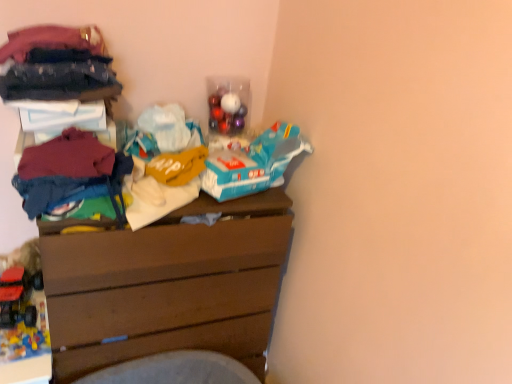
Question: Is the depth of rubberized plastic toy truck at lower left, acting as the first toy starting from the top, less than that of brown wooden chest of drawers at center?

Choices:
 (A) no
 (B) yes

Answer: (A)

Question: Can we say rubberized plastic toy truck at lower left, acting as the first toy starting from the top, lies outside brown wooden chest of drawers at center?

Choices:
 (A) no
 (B) yes

Answer: (B)

Question: Is rubberized plastic toy truck at lower left, acting as the first toy starting from the top, oriented towards brown wooden chest of drawers at center?

Choices:
 (A) no
 (B) yes

Answer: (A)

Question: From the image's perspective, is rubberized plastic toy truck at lower left, acting as the first toy starting from the top, beneath brown wooden chest of drawers at center?

Choices:
 (A) no
 (B) yes

Answer: (A)

Question: Does rubberized plastic toy truck at lower left, placed as the 2th toy when sorted from bottom to top, lie behind brown wooden chest of drawers at center?

Choices:
 (A) no
 (B) yes

Answer: (B)

Question: Considering the positions of rubberized plastic toy truck at lower left, which ranks as the second toy in top-to-bottom order, and brown wooden chest of drawers at center in the image, is rubberized plastic toy truck at lower left, which ranks as the second toy in top-to-bottom order, taller or shorter than brown wooden chest of drawers at center?

Choices:
 (A) short
 (B) tall

Answer: (A)

Question: From the image's perspective, is rubberized plastic toy truck at lower left, positioned as the 1th toy in bottom-to-top order, positioned above or below brown wooden chest of drawers at center?

Choices:
 (A) above
 (B) below

Answer: (B)

Question: In terms of width, does rubberized plastic toy truck at lower left, which ranks as the second toy in top-to-bottom order, look wider or thinner when compared to brown wooden chest of drawers at center?

Choices:
 (A) wide
 (B) thin

Answer: (B)

Question: Is point (14, 327) positioned closer to the camera than point (229, 236)?

Choices:
 (A) closer
 (B) farther

Answer: (B)

Question: From the image's perspective, is brown wooden chest of drawers at center positioned above or below rubberized plastic toy truck at lower left, acting as the first toy starting from the top?

Choices:
 (A) below
 (B) above

Answer: (A)

Question: From a real-world perspective, is brown wooden chest of drawers at center physically located above or below rubberized plastic toy truck at lower left, acting as the first toy starting from the top?

Choices:
 (A) above
 (B) below

Answer: (B)

Question: Looking at their shapes, would you say brown wooden chest of drawers at center is wider or thinner than rubberized plastic toy truck at lower left, placed as the 2th toy when sorted from bottom to top?

Choices:
 (A) thin
 (B) wide

Answer: (B)

Question: Is brown wooden chest of drawers at center taller or shorter than rubberized plastic toy truck at lower left, acting as the first toy starting from the top?

Choices:
 (A) tall
 (B) short

Answer: (A)

Question: From a real-world perspective, is rubberized plastic toy truck at lower left, placed as the 2th toy when sorted from bottom to top, positioned above or below maroon cotton sweater at left, marked as the third clothing in a top-to-bottom arrangement?

Choices:
 (A) below
 (B) above

Answer: (A)

Question: Considering the positions of rubberized plastic toy truck at lower left, placed as the 2th toy when sorted from bottom to top, and maroon cotton sweater at left, the first clothing when ordered from bottom to top, in the image, is rubberized plastic toy truck at lower left, placed as the 2th toy when sorted from bottom to top, taller or shorter than maroon cotton sweater at left, the first clothing when ordered from bottom to top,?

Choices:
 (A) short
 (B) tall

Answer: (A)